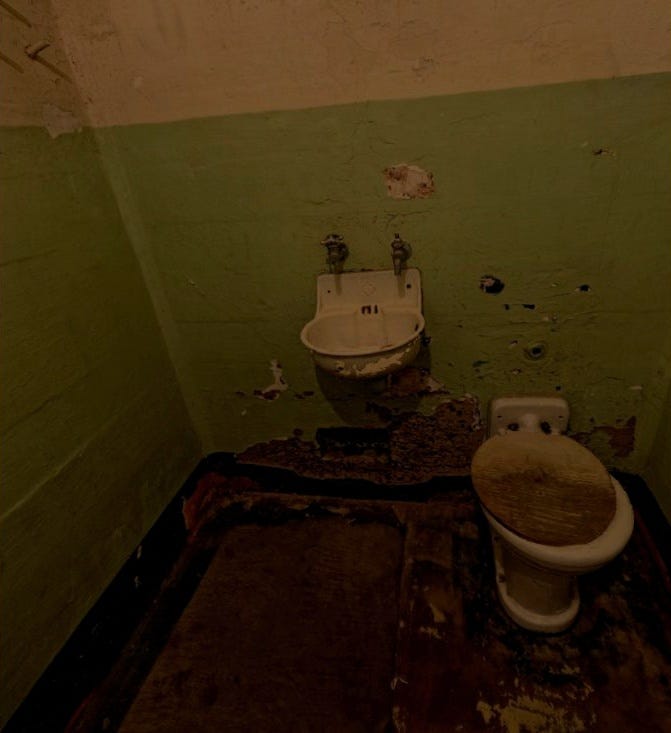
The image size is (671, 733). Identify the location of vent. (362, 443).